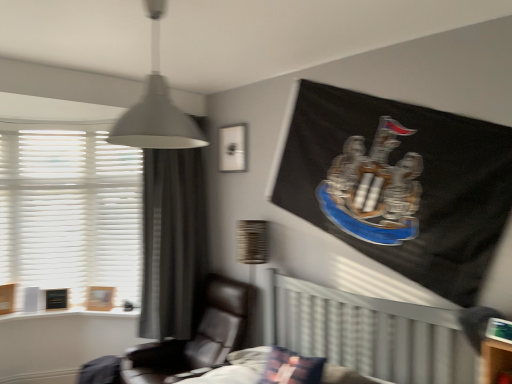
Question: From the image's perspective, is matte white picture frame at upper center, the second picture frame ordered from the bottom, located above or below plush fabric pillow at center?

Choices:
 (A) above
 (B) below

Answer: (A)

Question: Is matte white picture frame at upper center, which is counted as the first picture frame, starting from the front, in front of or behind plush fabric pillow at center in the image?

Choices:
 (A) front
 (B) behind

Answer: (B)

Question: Which of these objects is positioned farthest from the wooden frame at lower left, positioned as the first picture frame in left-to-right order?

Choices:
 (A) plush fabric pillow at center
 (B) black leather chair at center
 (C) wooden textured lampshade at center
 (D) white matte lampshade at upper center
 (E) gray fabric curtain at left

Answer: (D)

Question: Considering the real-world distances, which object is farthest from the matte white picture frame at upper center, which is counted as the first picture frame, starting from the front?

Choices:
 (A) white matte lampshade at upper center
 (B) black leather chair at center
 (C) plush fabric pillow at center
 (D) wooden textured lampshade at center
 (E) gray fabric curtain at left

Answer: (C)